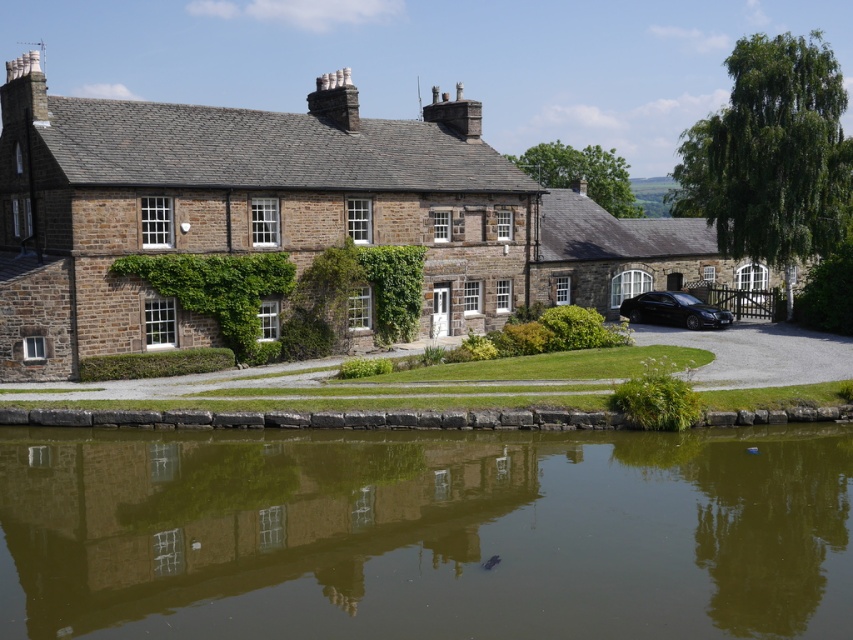
You are a gardener planning to install a new sprinkler system. You need to place a sprinkler between the green reflective water at lower center and the brown stone cottage at center. Which object should the sprinkler be closer to, considering their widths?

The green reflective water at lower center is thinner than the brown stone cottage at center, so the sprinkler should be placed closer to the green reflective water at lower center to ensure adequate coverage.

You are planning to build a small wooden dock on the green reflective water at lower center. Since the brown stone cottage at center is nearby, will the dock be easily visible from the cottage? Please explain based on their sizes.

The green reflective water at lower center has a smaller size compared to the brown stone cottage at center. Since the water is smaller, the dock built on it might be less prominent against the larger cottage, making it potentially harder to see from the cottage.

You are a landscape designer planning to plant a row of trees between the brown stone cottage at center and the matte stone cottage at right. Given their widths, which cottage will require more space for the trees to be evenly spaced on both sides?

The brown stone cottage at center has a greater width than the matte stone cottage at right, so it will require more space for the trees to be evenly spaced on both sides.